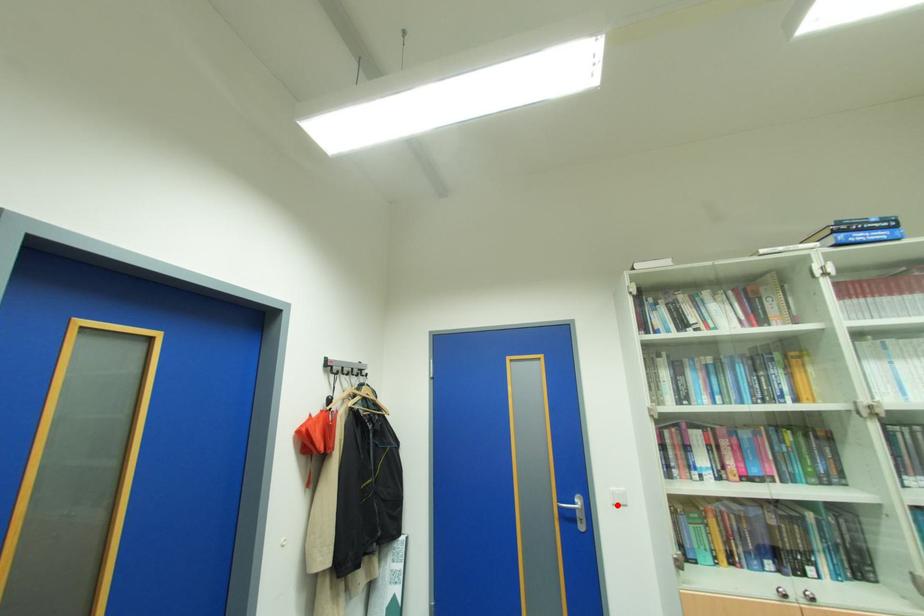
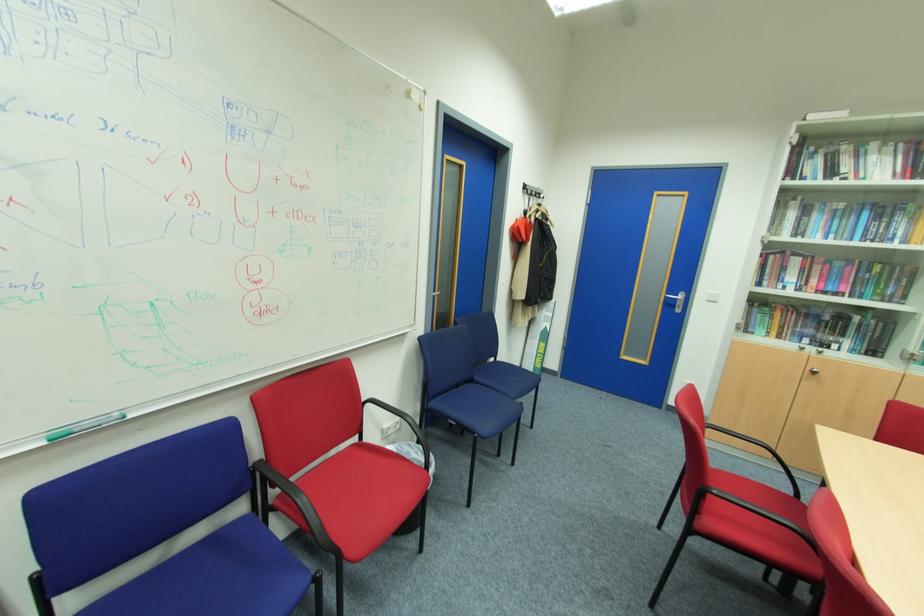
Locate, in the second image, the point that corresponds to the highlighted location in the first image.

(711, 301)